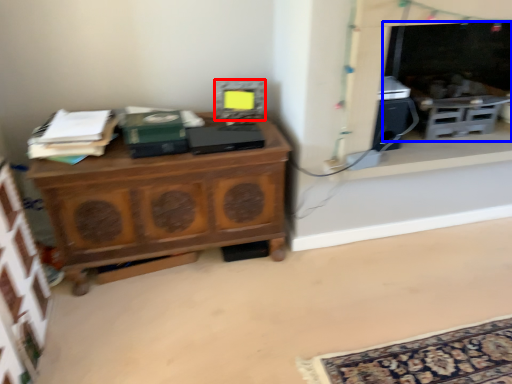
Question: Which point is closer to the camera, appliance (highlighted by a red box) or fireplace (highlighted by a blue box)?

Choices:
 (A) appliance
 (B) fireplace

Answer: (B)